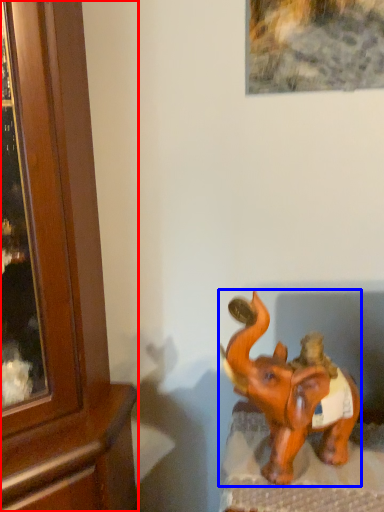
Question: Which of the following is the closest to the observer, cabinetry (highlighted by a red box) or elephant (highlighted by a blue box)?

Choices:
 (A) cabinetry
 (B) elephant

Answer: (A)